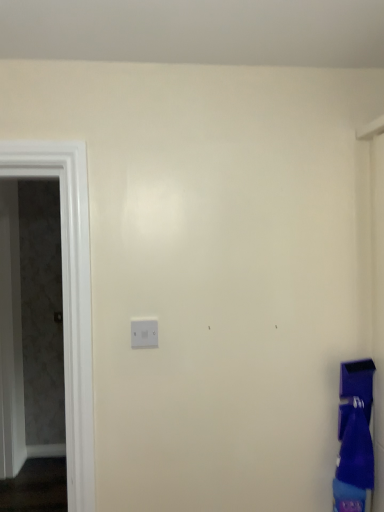
Question: Should I look upward or downward to see matte gray screen door at left?

Choices:
 (A) up
 (B) down

Answer: (B)

Question: Does matte gray screen door at left have a larger size compared to matte blue laundry at lower right?

Choices:
 (A) yes
 (B) no

Answer: (A)

Question: From the image's perspective, is matte gray screen door at left on matte blue laundry at lower right?

Choices:
 (A) no
 (B) yes

Answer: (B)

Question: Does matte gray screen door at left have a greater width compared to matte blue laundry at lower right?

Choices:
 (A) yes
 (B) no

Answer: (B)

Question: Is matte gray screen door at left with matte blue laundry at lower right?

Choices:
 (A) yes
 (B) no

Answer: (B)

Question: From a real-world perspective, is matte gray screen door at left under matte blue laundry at lower right?

Choices:
 (A) no
 (B) yes

Answer: (A)

Question: Can you confirm if matte gray screen door at left is positioned to the right of matte blue laundry at lower right?

Choices:
 (A) no
 (B) yes

Answer: (A)

Question: Considering the relative positions of matte blue laundry at lower right and matte gray screen door at left in the image provided, is matte blue laundry at lower right in front of matte gray screen door at left?

Choices:
 (A) no
 (B) yes

Answer: (B)

Question: Considering the relative sizes of matte blue laundry at lower right and matte gray screen door at left in the image provided, is matte blue laundry at lower right taller than matte gray screen door at left?

Choices:
 (A) no
 (B) yes

Answer: (A)

Question: Can you see matte blue laundry at lower right touching matte gray screen door at left?

Choices:
 (A) yes
 (B) no

Answer: (B)

Question: Is matte gray screen door at left located within matte blue laundry at lower right?

Choices:
 (A) yes
 (B) no

Answer: (B)

Question: From a real-world perspective, is matte blue laundry at lower right located higher than matte gray screen door at left?

Choices:
 (A) no
 (B) yes

Answer: (A)

Question: Could you tell me if matte blue laundry at lower right is turned towards matte gray screen door at left?

Choices:
 (A) no
 (B) yes

Answer: (A)

Question: Considering the relative positions of matte gray screen door at left and matte blue laundry at lower right in the image provided, is matte gray screen door at left to the left or to the right of matte blue laundry at lower right?

Choices:
 (A) left
 (B) right

Answer: (A)